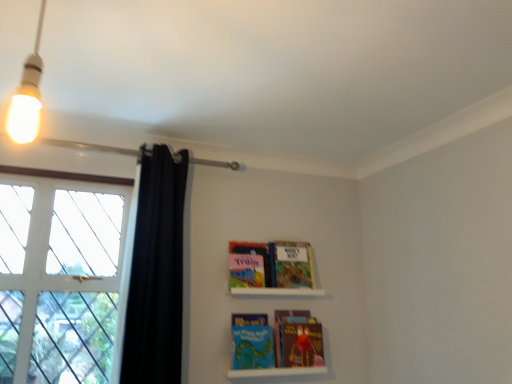
The image size is (512, 384). What do you see at coordinates (59, 278) in the screenshot? I see `white glass window at left` at bounding box center [59, 278].

What is the approximate height of white matte shelf at upper center, which is the 1th shelf from top to bottom?

2.38 inches.

At what (x,y) coordinates should I click in order to perform the action: click on hardcover book at upper center, which is counted as the 3th paperback book, starting from the bottom. Please return your answer as a coordinate pair (x, y). The width and height of the screenshot is (512, 384). Looking at the image, I should click on (291, 264).

From a real-world perspective, which object stands above the other?

From a 3D spatial view, multicolored paper at lower center, which is the first paperback book in bottom-to-top order, is above.

Is blue matte paperback book at center, arranged as the third paperback book when viewed from the top, facing away from multicolored paper at lower center, acting as the fourth paperback book starting from the top?

blue matte paperback book at center, arranged as the third paperback book when viewed from the top, is not turned away from multicolored paper at lower center, acting as the fourth paperback book starting from the top.

Considering the positions of point (267, 338) and point (278, 312), is point (267, 338) closer or farther from the camera than point (278, 312)?

Clearly, point (267, 338) is closer to the camera than point (278, 312).

Consider the image. Is the position of blue matte paperback book at center, arranged as the third paperback book when viewed from the top, more distant than that of multicolored paper at lower center, which is the first paperback book in bottom-to-top order?

That is False.

In the image, is matte plastic books at lower center, placed as the second shelf when sorted from top to bottom, positioned in front of or behind white matte shelf at upper center, which is the 1th shelf from top to bottom?

matte plastic books at lower center, placed as the second shelf when sorted from top to bottom, is positioned closer to the viewer than white matte shelf at upper center, which is the 1th shelf from top to bottom.

This screenshot has width=512, height=384. What are the coordinates of `shelf below the white matte shelf at upper center, which is the 1th shelf from top to bottom (from a real-world perspective)` in the screenshot? It's located at (276, 372).

Considering the positions of objects matte plastic books at lower center, placed as the second shelf when sorted from top to bottom, and white matte shelf at upper center, the second shelf ordered from the bottom, in the image provided, who is more to the left, matte plastic books at lower center, placed as the second shelf when sorted from top to bottom, or white matte shelf at upper center, the second shelf ordered from the bottom,?

matte plastic books at lower center, placed as the second shelf when sorted from top to bottom, is more to the left.

From a real-world perspective, count 2nd paperback books upward from the blue matte paperback book at center, arranged as the third paperback book when viewed from the top, and point to it. Please provide its 2D coordinates.

[(249, 264)]

Considering the sizes of matte blue book at center, which ranks as the fourth paperback book in bottom-to-top order, and blue matte paperback book at center, the 2th paperback book positioned from the bottom, in the image, is matte blue book at center, which ranks as the fourth paperback book in bottom-to-top order, wider or thinner than blue matte paperback book at center, the 2th paperback book positioned from the bottom,?

Clearly, matte blue book at center, which ranks as the fourth paperback book in bottom-to-top order, has more width compared to blue matte paperback book at center, the 2th paperback book positioned from the bottom.

Which point is more distant from viewer, (241, 271) or (253, 362)?

The point (241, 271) is farther from the camera.

Which is nearer, [85,263] or [234,282]?

Clearly, point [85,263] is closer to the camera than point [234,282].

Is white glass window at left wider than matte blue book at center, which ranks as the 1th paperback book in top-to-bottom order?

Yes.

Is matte blue book at center, which ranks as the 1th paperback book in top-to-bottom order, surrounded by white glass window at left?

No, matte blue book at center, which ranks as the 1th paperback book in top-to-bottom order, is located outside of white glass window at left.

Consider the image. Is white glass window at left not near matte blue book at center, which ranks as the 1th paperback book in top-to-bottom order?

That's not correct — white glass window at left is a little close to matte blue book at center, which ranks as the 1th paperback book in top-to-bottom order.

Based on the photo, is black fabric curtain at left beside blue matte paperback book at center, the 2th paperback book positioned from the bottom?

black fabric curtain at left and blue matte paperback book at center, the 2th paperback book positioned from the bottom, are clearly separated.

Considering the sizes of objects black fabric curtain at left and blue matte paperback book at center, the 2th paperback book positioned from the bottom, in the image provided, who is taller, black fabric curtain at left or blue matte paperback book at center, the 2th paperback book positioned from the bottom,?

With more height is black fabric curtain at left.

Is blue matte paperback book at center, the 2th paperback book positioned from the bottom, a part of black fabric curtain at left?

Definitely not — blue matte paperback book at center, the 2th paperback book positioned from the bottom, is not inside black fabric curtain at left.

Which of these two, multicolored paper at lower center, acting as the fourth paperback book starting from the top, or hardcover book at upper center, which is counted as the 3th paperback book, starting from the bottom, stands taller?

With more height is multicolored paper at lower center, acting as the fourth paperback book starting from the top.

Is multicolored paper at lower center, acting as the fourth paperback book starting from the top, at the right side of hardcover book at upper center, which is counted as the 3th paperback book, starting from the bottom?

Yes.

What's the angular difference between multicolored paper at lower center, which is the first paperback book in bottom-to-top order, and hardcover book at upper center, which is counted as the second paperback book, starting from the top,'s facing directions?

The facing directions of multicolored paper at lower center, which is the first paperback book in bottom-to-top order, and hardcover book at upper center, which is counted as the second paperback book, starting from the top, are 1.22 degrees apart.

Is hardcover book at upper center, which is counted as the 3th paperback book, starting from the bottom, positioned with its back to blue matte paperback book at center, arranged as the third paperback book when viewed from the top?

No, hardcover book at upper center, which is counted as the 3th paperback book, starting from the bottom,'s orientation is not away from blue matte paperback book at center, arranged as the third paperback book when viewed from the top.

Can you confirm if hardcover book at upper center, which is counted as the 3th paperback book, starting from the bottom, is positioned to the right of blue matte paperback book at center, arranged as the third paperback book when viewed from the top?

Yes.

Is hardcover book at upper center, which is counted as the second paperback book, starting from the top, in front of blue matte paperback book at center, the 2th paperback book positioned from the bottom?

No, it is not.

Is hardcover book at upper center, which is counted as the second paperback book, starting from the top, completely or partially outside of blue matte paperback book at center, the 2th paperback book positioned from the bottom?

hardcover book at upper center, which is counted as the second paperback book, starting from the top, is positioned outside blue matte paperback book at center, the 2th paperback book positioned from the bottom.

Locate an element on the screen. The image size is (512, 384). paperback book that is the 1st object located behind the blue matte paperback book at center, the 2th paperback book positioned from the bottom is located at coordinates (280, 328).

Where is `shelf that is under the white matte shelf at upper center, which is the 1th shelf from top to bottom (from a real-world perspective)`? shelf that is under the white matte shelf at upper center, which is the 1th shelf from top to bottom (from a real-world perspective) is located at coordinates (276, 372).

Which object lies nearer to the anchor point multicolored paper at lower center, acting as the fourth paperback book starting from the top, white glass window at left or black fabric curtain at left?

Based on the image, black fabric curtain at left appears to be nearer to multicolored paper at lower center, acting as the fourth paperback book starting from the top.

Estimate the real-world distances between objects in this image. Which object is further from multicolored paper at lower center, which is the first paperback book in bottom-to-top order, white matte shelf at upper center, the second shelf ordered from the bottom, or hardcover book at upper center, which is counted as the second paperback book, starting from the top?

Among the two, hardcover book at upper center, which is counted as the second paperback book, starting from the top, is located further to multicolored paper at lower center, which is the first paperback book in bottom-to-top order.

Which object lies nearer to the anchor point multicolored paper at lower center, which is the first paperback book in bottom-to-top order, hardcover book at upper center, which is counted as the 3th paperback book, starting from the bottom, or black fabric curtain at left?

hardcover book at upper center, which is counted as the 3th paperback book, starting from the bottom, is closer to multicolored paper at lower center, which is the first paperback book in bottom-to-top order.

When comparing their distances from black fabric curtain at left, does matte blue book at center, which ranks as the 1th paperback book in top-to-bottom order, or hardcover book at upper center, which is counted as the second paperback book, starting from the top, seem further?

hardcover book at upper center, which is counted as the second paperback book, starting from the top, is further to black fabric curtain at left.

Which object lies nearer to the anchor point multicolored paper at lower center, which is the first paperback book in bottom-to-top order, black fabric curtain at left or matte blue book at center, which ranks as the fourth paperback book in bottom-to-top order?

The object closer to multicolored paper at lower center, which is the first paperback book in bottom-to-top order, is matte blue book at center, which ranks as the fourth paperback book in bottom-to-top order.

Looking at the image, which one is located further to white glass window at left, matte blue book at center, which ranks as the 1th paperback book in top-to-bottom order, or white matte shelf at upper center, the second shelf ordered from the bottom?

Based on the image, white matte shelf at upper center, the second shelf ordered from the bottom, appears to be further to white glass window at left.

Looking at the image, which one is located closer to hardcover book at upper center, which is counted as the second paperback book, starting from the top, black fabric curtain at left or matte blue book at center, which ranks as the fourth paperback book in bottom-to-top order?

Among the two, matte blue book at center, which ranks as the fourth paperback book in bottom-to-top order, is located nearer to hardcover book at upper center, which is counted as the second paperback book, starting from the top.

Which object lies nearer to the anchor point black fabric curtain at left, multicolored paper at lower center, which is the first paperback book in bottom-to-top order, or white glass window at left?

white glass window at left.

Where is `shelf that lies between matte blue book at center, which ranks as the fourth paperback book in bottom-to-top order, and multicolored paper at lower center, acting as the fourth paperback book starting from the top, from top to bottom`? This screenshot has width=512, height=384. shelf that lies between matte blue book at center, which ranks as the fourth paperback book in bottom-to-top order, and multicolored paper at lower center, acting as the fourth paperback book starting from the top, from top to bottom is located at coordinates (276, 291).

In order to click on shelf located between white glass window at left and white matte shelf at upper center, which is the 1th shelf from top to bottom, in the left-right direction in this screenshot , I will do `click(276, 372)`.

Find the location of a particular element. The width and height of the screenshot is (512, 384). shelf between black fabric curtain at left and white matte shelf at upper center, which is the 1th shelf from top to bottom, in the horizontal direction is located at coordinates (276, 372).

The width and height of the screenshot is (512, 384). I want to click on paperback book located between black fabric curtain at left and blue matte paperback book at center, the 2th paperback book positioned from the bottom, in the left-right direction, so click(x=249, y=264).